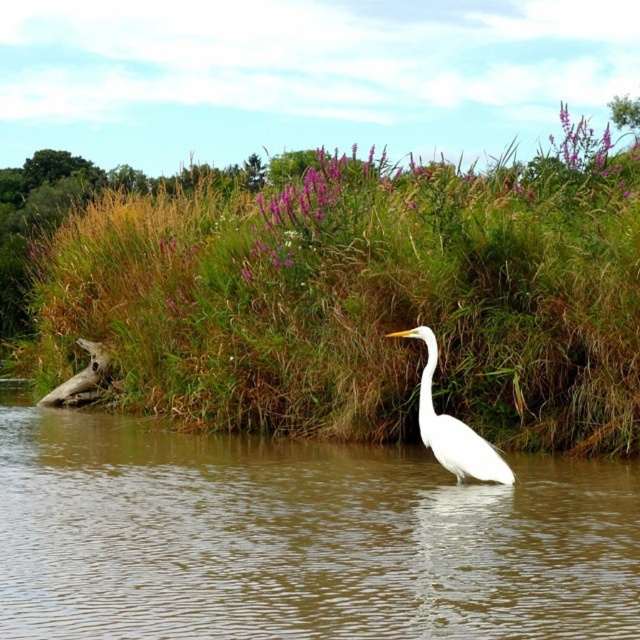
Question: Can you confirm if green grass at center is wider than brown muddy water at center?

Choices:
 (A) yes
 (B) no

Answer: (A)

Question: Which point is closer to the camera?

Choices:
 (A) (4, 614)
 (B) (481, 288)
 (C) (456, 424)

Answer: (A)

Question: Based on their relative distances, which object is farther from the white smooth heron at center?

Choices:
 (A) green grass at center
 (B) brown muddy water at center

Answer: (A)

Question: Does green grass at center have a lesser width compared to brown muddy water at center?

Choices:
 (A) yes
 (B) no

Answer: (B)

Question: Does brown muddy water at center have a greater width compared to white smooth heron at center?

Choices:
 (A) no
 (B) yes

Answer: (B)

Question: Based on their relative distances, which object is farther from the green grass at center?

Choices:
 (A) brown muddy water at center
 (B) white smooth heron at center

Answer: (B)